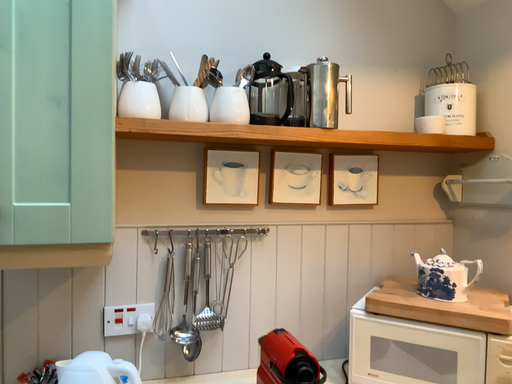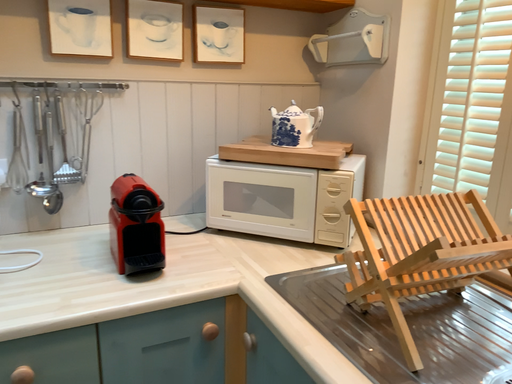
Question: Which way did the camera rotate in the video?

Choices:
 (A) rotated right
 (B) rotated left

Answer: (A)